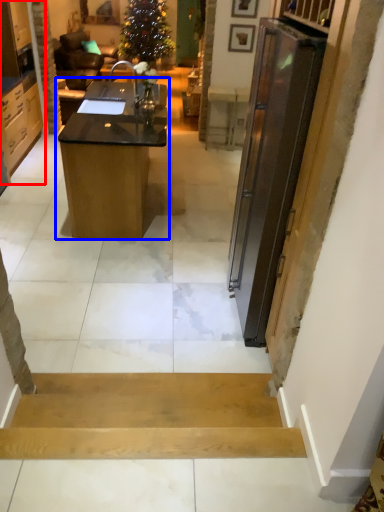
Question: Which of the following is the closest to the observer, cabinetry (highlighted by a red box) or desk (highlighted by a blue box)?

Choices:
 (A) cabinetry
 (B) desk

Answer: (B)